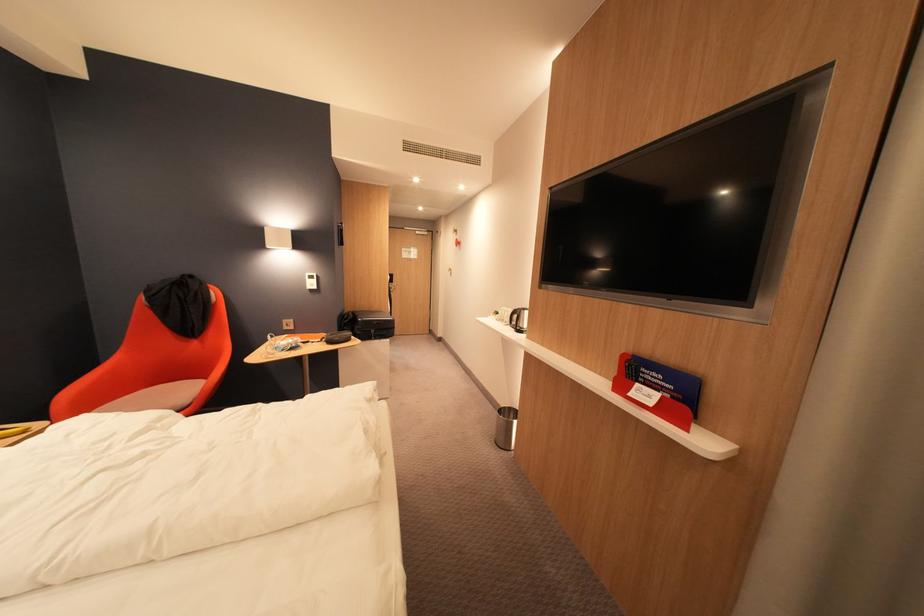
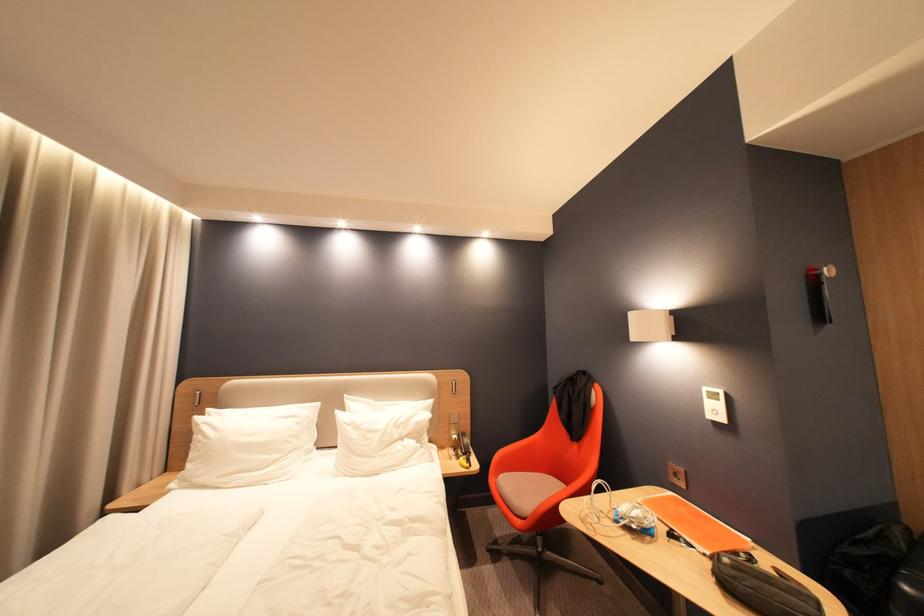
Find the pixel in the second image that matches point 351,225 in the first image.

(830, 270)